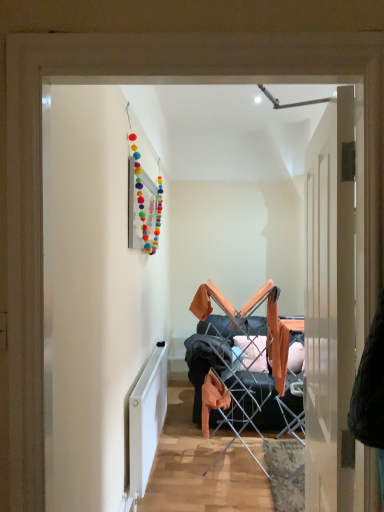
Question: Is the depth of white matte radiator at lower left greater than that of wooden door at right?

Choices:
 (A) yes
 (B) no

Answer: (A)

Question: Can you confirm if white matte radiator at lower left is wider than wooden door at right?

Choices:
 (A) no
 (B) yes

Answer: (A)

Question: Can we say white matte radiator at lower left lies outside wooden door at right?

Choices:
 (A) yes
 (B) no

Answer: (A)

Question: From a real-world perspective, does white matte radiator at lower left stand above wooden door at right?

Choices:
 (A) no
 (B) yes

Answer: (A)

Question: Is wooden door at right completely or partially inside white matte radiator at lower left?

Choices:
 (A) yes
 (B) no

Answer: (B)

Question: Can you confirm if white matte radiator at lower left is smaller than wooden door at right?

Choices:
 (A) no
 (B) yes

Answer: (B)

Question: Is wooden door at right positioned with its back to white matte radiator at lower left?

Choices:
 (A) yes
 (B) no

Answer: (B)

Question: Considering the relative sizes of wooden door at right and white matte radiator at lower left in the image provided, is wooden door at right smaller than white matte radiator at lower left?

Choices:
 (A) yes
 (B) no

Answer: (B)

Question: From the image's perspective, is wooden door at right over white matte radiator at lower left?

Choices:
 (A) no
 (B) yes

Answer: (B)

Question: Is wooden door at right shorter than white matte radiator at lower left?

Choices:
 (A) no
 (B) yes

Answer: (A)

Question: Is wooden door at right aimed at white matte radiator at lower left?

Choices:
 (A) yes
 (B) no

Answer: (B)

Question: Considering the relative sizes of wooden door at right and white matte radiator at lower left in the image provided, is wooden door at right taller than white matte radiator at lower left?

Choices:
 (A) yes
 (B) no

Answer: (A)

Question: Does point coord(340,166) appear closer or farther from the camera than point coord(150,454)?

Choices:
 (A) farther
 (B) closer

Answer: (B)